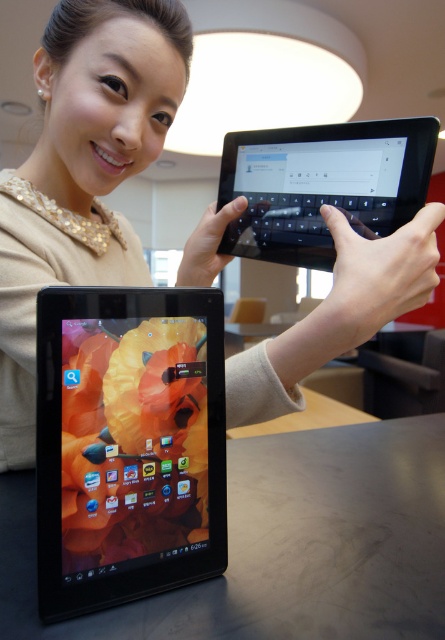
Question: Can you confirm if black matte table at lower center is positioned above black glossy tablet at center?

Choices:
 (A) yes
 (B) no

Answer: (B)

Question: Which point is closer to the camera?

Choices:
 (A) matte black tablet at center
 (B) matte black tablet at lower left

Answer: (A)

Question: Does black matte table at lower center appear on the right side of black glossy tablet at center?

Choices:
 (A) yes
 (B) no

Answer: (A)

Question: Which object appears farthest from the camera in this image?

Choices:
 (A) black matte table at lower center
 (B) matte black tablet at lower left
 (C) black glossy tablet at center

Answer: (C)

Question: Can you confirm if matte black tablet at center is thinner than black glossy tablet at center?

Choices:
 (A) yes
 (B) no

Answer: (A)

Question: Which point is closer to the camera taking this photo?

Choices:
 (A) (162, 477)
 (B) (265, 406)
 (C) (352, 196)
 (D) (319, 620)

Answer: (D)